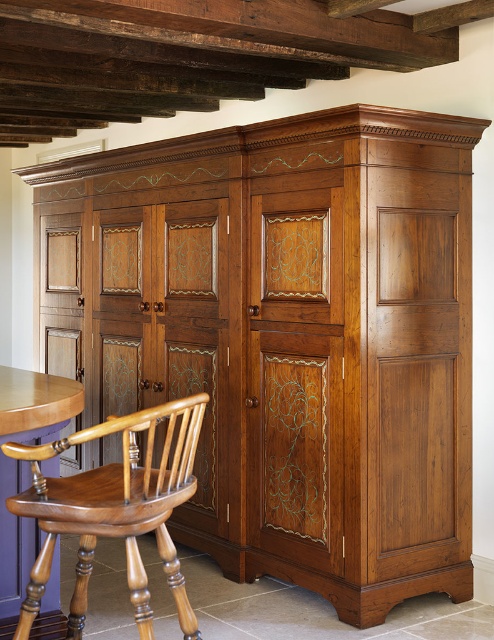
Question: Is polished wood captain's chair at lower left closer to camera compared to mahogany table at lower left?

Choices:
 (A) yes
 (B) no

Answer: (A)

Question: Can you confirm if polished wood captain's chair at lower left is positioned above mahogany table at lower left?

Choices:
 (A) no
 (B) yes

Answer: (A)

Question: Which point appears closest to the camera in this image?

Choices:
 (A) (14, 609)
 (B) (127, 557)

Answer: (B)

Question: Does polished wood captain's chair at lower left appear over mahogany table at lower left?

Choices:
 (A) no
 (B) yes

Answer: (A)

Question: Which point is farther from the camera taking this photo?

Choices:
 (A) (141, 582)
 (B) (23, 397)

Answer: (B)

Question: Which point is closer to the camera taking this photo?

Choices:
 (A) (38, 435)
 (B) (127, 465)

Answer: (B)